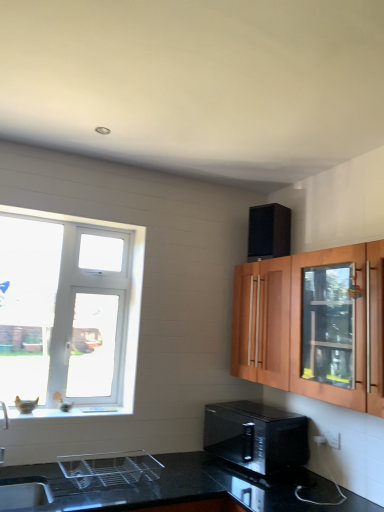
Question: Considering the relative positions of black glossy microwave at lower center and white glossy window sill at lower left in the image provided, is black glossy microwave at lower center to the left of white glossy window sill at lower left from the viewer's perspective?

Choices:
 (A) no
 (B) yes

Answer: (A)

Question: Is black glossy microwave at lower center further to camera compared to white glossy window sill at lower left?

Choices:
 (A) no
 (B) yes

Answer: (A)

Question: Considering the relative sizes of black glossy microwave at lower center and white glossy window sill at lower left in the image provided, is black glossy microwave at lower center smaller than white glossy window sill at lower left?

Choices:
 (A) yes
 (B) no

Answer: (B)

Question: Is black glossy microwave at lower center outside white glossy window sill at lower left?

Choices:
 (A) no
 (B) yes

Answer: (B)

Question: Considering the relative sizes of black glossy microwave at lower center and white glossy window sill at lower left in the image provided, is black glossy microwave at lower center taller than white glossy window sill at lower left?

Choices:
 (A) no
 (B) yes

Answer: (B)

Question: In terms of width, does black textured speaker at upper right, the 1th appliance viewed from the back, look wider or thinner when compared to black glossy microwave at lower center?

Choices:
 (A) wide
 (B) thin

Answer: (B)

Question: Is black textured speaker at upper right, which is the second appliance from left to right, taller or shorter than black glossy microwave at lower center?

Choices:
 (A) short
 (B) tall

Answer: (B)

Question: Considering their positions, is black textured speaker at upper right, which is counted as the second appliance, starting from the bottom, located in front of or behind black glossy microwave at lower center?

Choices:
 (A) front
 (B) behind

Answer: (B)

Question: Visually, is black textured speaker at upper right, the 1th appliance viewed from the back, positioned to the left or to the right of black glossy microwave at lower center?

Choices:
 (A) right
 (B) left

Answer: (A)

Question: Is white plastic window at left wider or thinner than clear glass dish rack at lower center, which appears as the 2th appliance when viewed from the top?

Choices:
 (A) thin
 (B) wide

Answer: (A)

Question: Considering the positions of point (114, 265) and point (114, 485), is point (114, 265) closer or farther from the camera than point (114, 485)?

Choices:
 (A) farther
 (B) closer

Answer: (A)

Question: From the image's perspective, is white plastic window at left positioned above or below clear glass dish rack at lower center, which is the first appliance from front to back?

Choices:
 (A) below
 (B) above

Answer: (B)

Question: From a real-world perspective, relative to clear glass dish rack at lower center, which is the first appliance from front to back, is white plastic window at left vertically above or below?

Choices:
 (A) above
 (B) below

Answer: (A)

Question: In terms of height, does white glossy window sill at lower left look taller or shorter compared to black textured speaker at upper right, the 1th appliance viewed from the back?

Choices:
 (A) tall
 (B) short

Answer: (B)

Question: Relative to black textured speaker at upper right, the first appliance positioned from the top, is white glossy window sill at lower left in front or behind?

Choices:
 (A) behind
 (B) front

Answer: (B)